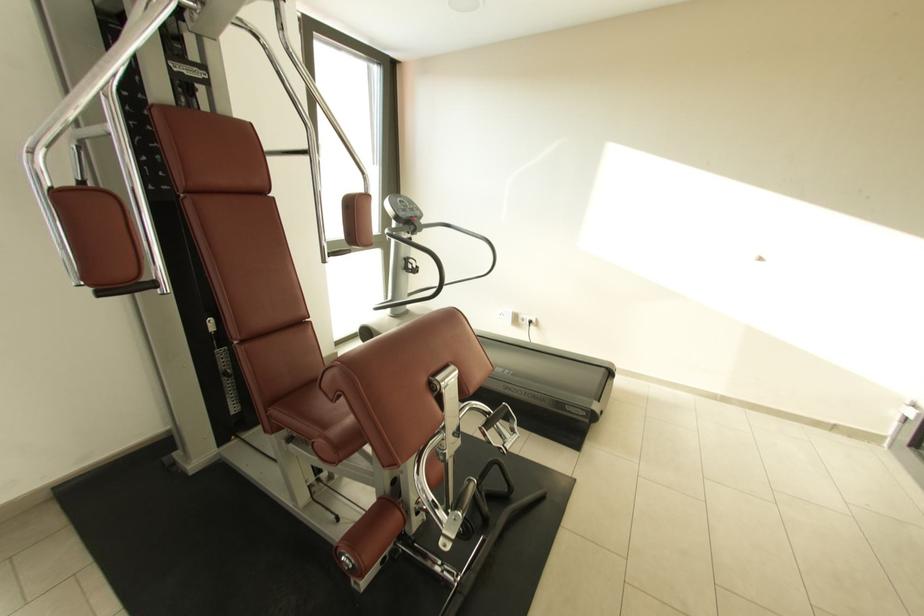
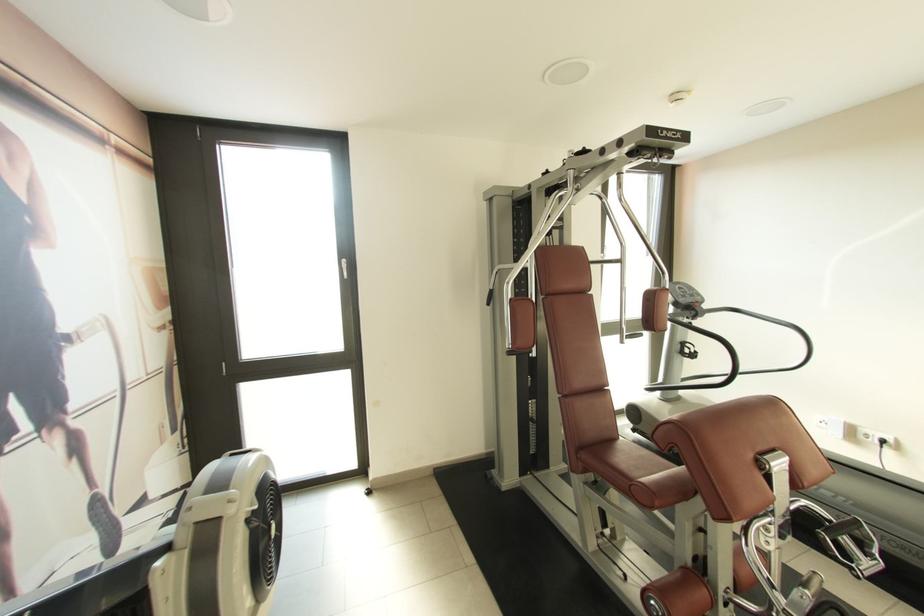
Find the pixel in the second image that matches (274,415) in the first image.

(582, 456)